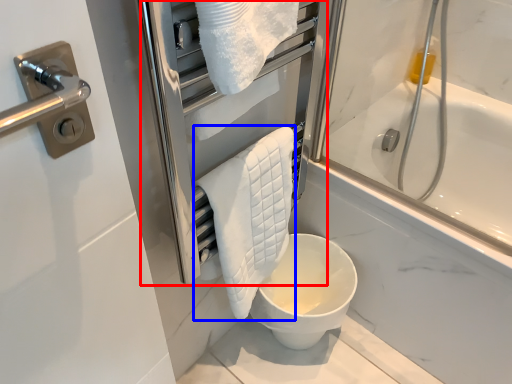
Question: Among these objects, which one is nearest to the camera, screen door (highlighted by a red box) or bath towel (highlighted by a blue box)?

Choices:
 (A) screen door
 (B) bath towel

Answer: (A)